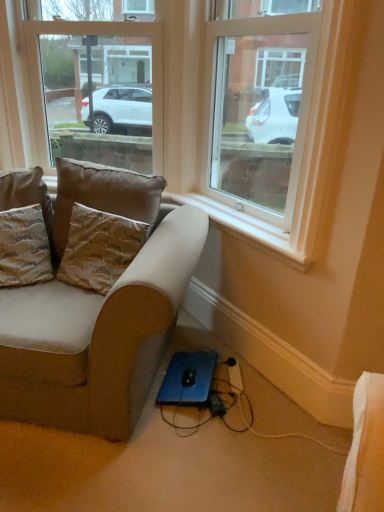
Question: Is brown fabric pillow at upper left, positioned as the third pillow in left-to-right order, smaller than clear glass window at upper center, which is counted as the first window, starting from the right?

Choices:
 (A) no
 (B) yes

Answer: (B)

Question: Is brown fabric pillow at upper left, positioned as the third pillow in left-to-right order, located outside clear glass window at upper center, marked as the 2th window in a left-to-right arrangement?

Choices:
 (A) yes
 (B) no

Answer: (A)

Question: Does brown fabric pillow at upper left, the 2th pillow from the right, have a larger size compared to clear glass window at upper center, marked as the 2th window in a left-to-right arrangement?

Choices:
 (A) yes
 (B) no

Answer: (B)

Question: From a real-world perspective, is brown fabric pillow at upper left, the 2th pillow from the right, below clear glass window at upper center, which is counted as the first window, starting from the right?

Choices:
 (A) no
 (B) yes

Answer: (B)

Question: Is brown fabric pillow at upper left, the 2th pillow from the right, thinner than clear glass window at upper center, marked as the 2th window in a left-to-right arrangement?

Choices:
 (A) yes
 (B) no

Answer: (A)

Question: Considering their positions, is black plastic extension cord at lower center located in front of or behind clear glass window at upper center, which ranks as the second window in right-to-left order?

Choices:
 (A) front
 (B) behind

Answer: (A)

Question: Is black plastic extension cord at lower center spatially inside clear glass window at upper center, marked as the 1th window in a left-to-right arrangement, or outside of it?

Choices:
 (A) inside
 (B) outside

Answer: (B)

Question: Considering the positions of black plastic extension cord at lower center and clear glass window at upper center, which ranks as the second window in right-to-left order, in the image, is black plastic extension cord at lower center taller or shorter than clear glass window at upper center, which ranks as the second window in right-to-left order,?

Choices:
 (A) tall
 (B) short

Answer: (B)

Question: Is black plastic extension cord at lower center bigger or smaller than clear glass window at upper center, marked as the 1th window in a left-to-right arrangement?

Choices:
 (A) small
 (B) big

Answer: (A)

Question: Considering their positions, is clear glass window at upper center, marked as the 2th window in a left-to-right arrangement, located in front of or behind beige fabric couch at lower left?

Choices:
 (A) behind
 (B) front

Answer: (B)

Question: In the image, is clear glass window at upper center, marked as the 2th window in a left-to-right arrangement, on the left side or the right side of beige fabric couch at lower left?

Choices:
 (A) left
 (B) right

Answer: (B)

Question: From a real-world perspective, relative to beige fabric couch at lower left, is clear glass window at upper center, which is counted as the first window, starting from the right, vertically above or below?

Choices:
 (A) below
 (B) above

Answer: (B)

Question: Which is correct: clear glass window at upper center, marked as the 2th window in a left-to-right arrangement, is inside beige fabric couch at lower left, or outside of it?

Choices:
 (A) inside
 (B) outside

Answer: (B)

Question: Looking at the image, does clear glass window at upper center, marked as the 1th window in a left-to-right arrangement, seem bigger or smaller compared to textured brown pillow at left, the first pillow viewed from the left?

Choices:
 (A) small
 (B) big

Answer: (B)

Question: Would you say clear glass window at upper center, which ranks as the second window in right-to-left order, is to the left or to the right of textured brown pillow at left, the first pillow viewed from the left, in the picture?

Choices:
 (A) right
 (B) left

Answer: (A)